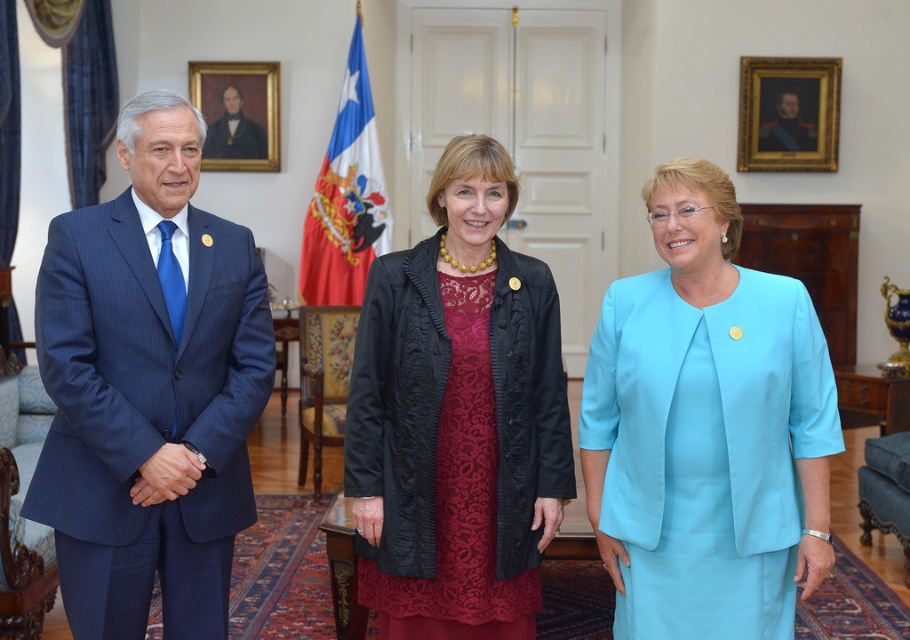
Does point (514, 499) come farther from viewer compared to point (378, 168)?

No, (514, 499) is in front of (378, 168).

How much distance is there between matte black coat at center and red-white flag at center?

A distance of 14.07 feet exists between matte black coat at center and red-white flag at center.

In order to click on matte black coat at center in this screenshot , I will do `click(457, 417)`.

Is blue pinstripe suit at left taller than smooth black suit at upper left?

Indeed, blue pinstripe suit at left has a greater height compared to smooth black suit at upper left.

Does point (51, 275) come in front of point (205, 156)?

Yes.

The image size is (910, 640). Find the location of `blue pinstripe suit at left`. blue pinstripe suit at left is located at coordinates (149, 388).

Is point (625, 452) more distant than point (251, 147)?

No, it is in front of (251, 147).

Consider the image. Can you confirm if light blue satin suit at center is shorter than smooth black suit at upper left?

No, light blue satin suit at center is not shorter than smooth black suit at upper left.

The height and width of the screenshot is (640, 910). What do you see at coordinates (706, 428) in the screenshot?
I see `light blue satin suit at center` at bounding box center [706, 428].

Where is `light blue satin suit at center`? light blue satin suit at center is located at coordinates (706, 428).